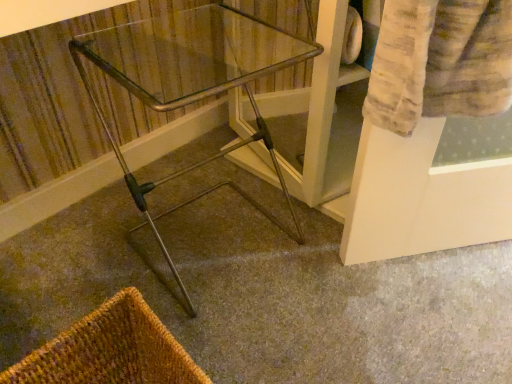
Question: Considering the relative positions of metallic silver walker at center and clear glass table at center in the image provided, is metallic silver walker at center to the left or to the right of clear glass table at center?

Choices:
 (A) right
 (B) left

Answer: (A)

Question: Considering the positions of point (337, 359) and point (184, 294), is point (337, 359) closer or farther from the camera than point (184, 294)?

Choices:
 (A) closer
 (B) farther

Answer: (A)

Question: Considering the real-world distances, which object is closest to the brown woven basket at lower left?

Choices:
 (A) metallic silver walker at center
 (B) clear glass table at center

Answer: (A)

Question: Considering the real-world distances, which object is closest to the metallic silver walker at center?

Choices:
 (A) brown woven basket at lower left
 (B) clear glass table at center

Answer: (B)